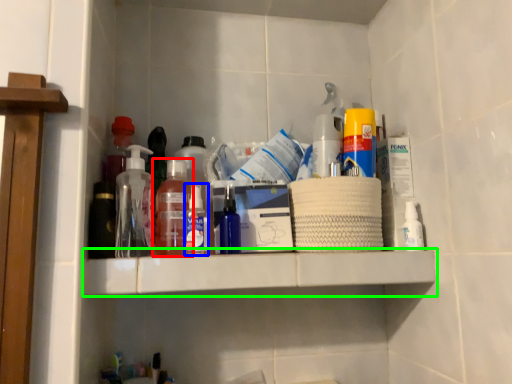
Question: Based on their relative distances, which object is farther from bottle (highlighted by a red box)? Choose from bottle (highlighted by a blue box) and shelf (highlighted by a green box).

Choices:
 (A) bottle
 (B) shelf

Answer: (B)